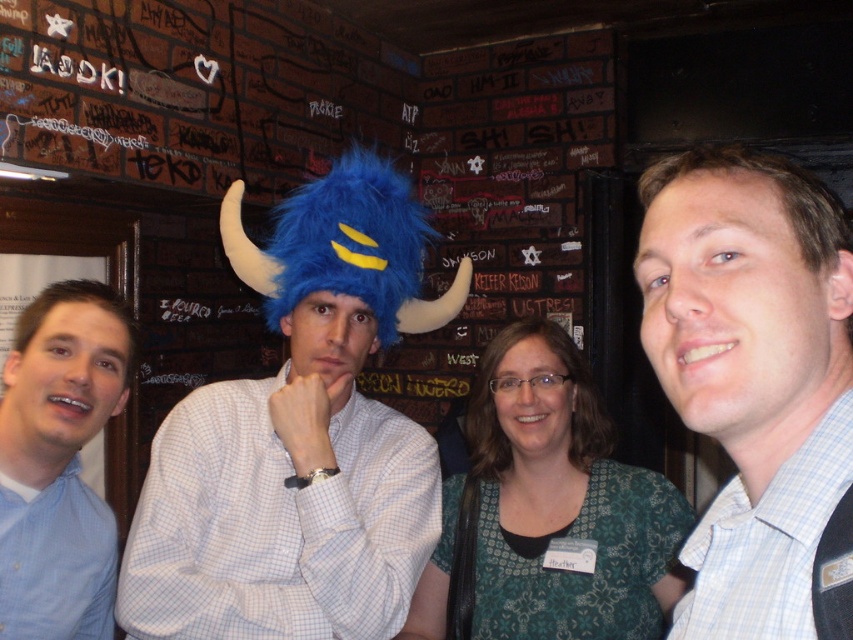
Which is in front, point (360, 346) or point (78, 285)?

Point (78, 285) is more forward.

Who is more forward, [218,499] or [91,403]?

Positioned in front is point [91,403].

This screenshot has width=853, height=640. What are the coordinates of `blue fuzzy hat at center` in the screenshot? It's located at (299, 442).

Consider the image. Does light blue checkered shirt at center appear on the right side of blue fuzzy hat at left?

Yes, light blue checkered shirt at center is to the right of blue fuzzy hat at left.

In the scene shown: Between light blue checkered shirt at center and blue fuzzy hat at left, which one has less height?

With less height is light blue checkered shirt at center.

Is point (749, 609) closer to viewer compared to point (28, 356)?

Yes, it is.

Identify the location of light blue checkered shirt at center. The width and height of the screenshot is (853, 640). (751, 372).

Which is above, blue fuzzy hat at center or light blue checkered shirt at center?

blue fuzzy hat at center

Can you confirm if blue fuzzy hat at center is positioned below light blue checkered shirt at center?

Incorrect, blue fuzzy hat at center is not positioned below light blue checkered shirt at center.

Is point (351, 268) positioned in front of point (833, 307)?

No, it is behind (833, 307).

You are a GUI agent. You are given a task and a screenshot of the screen. Output one action in this format:
    pyautogui.click(x=<x>, y=<y>)
    Task: Click on the blue fuzzy hat at center
    This screenshot has height=640, width=853.
    Given the screenshot: What is the action you would take?
    pyautogui.click(x=299, y=442)